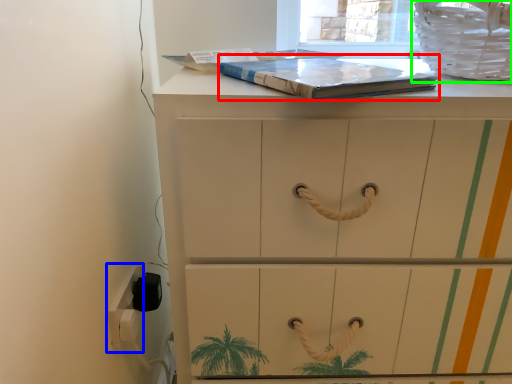
Question: Considering the real-world distances, which object is closest to paperback book (highlighted by a red box)? electric outlet (highlighted by a blue box) or laundry basket (highlighted by a green box).

Choices:
 (A) electric outlet
 (B) laundry basket

Answer: (B)